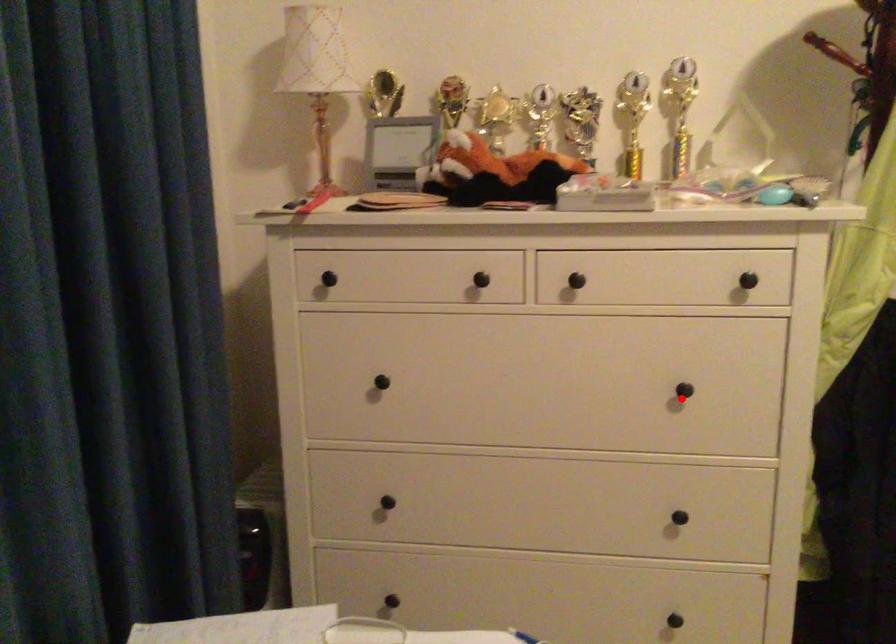
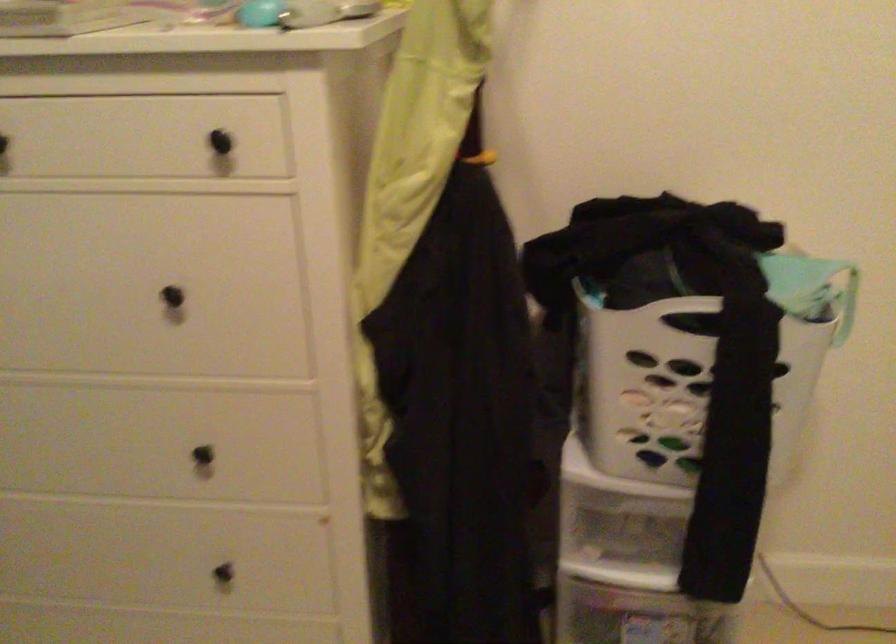
In the second image, find the point that corresponds to the highlighted location in the first image.

(178, 305)